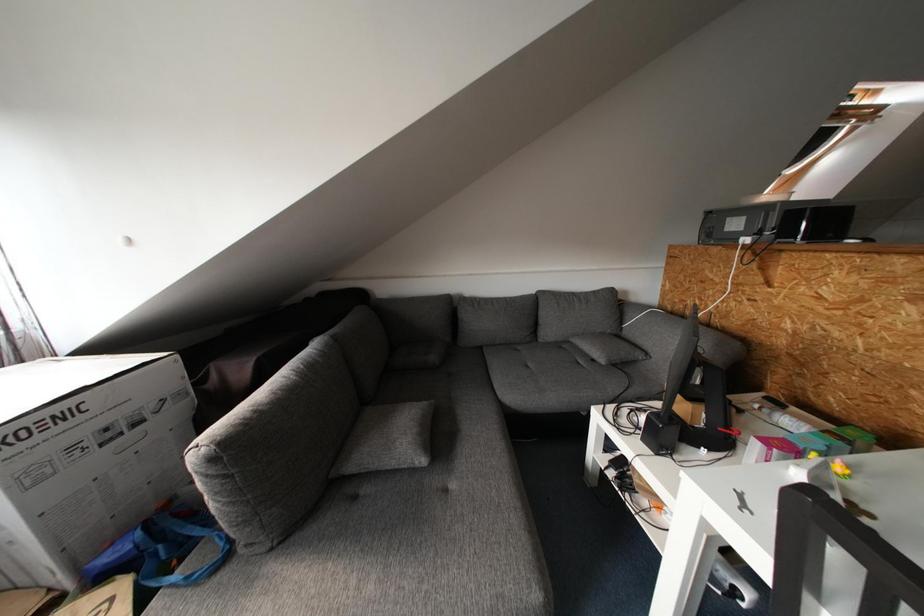
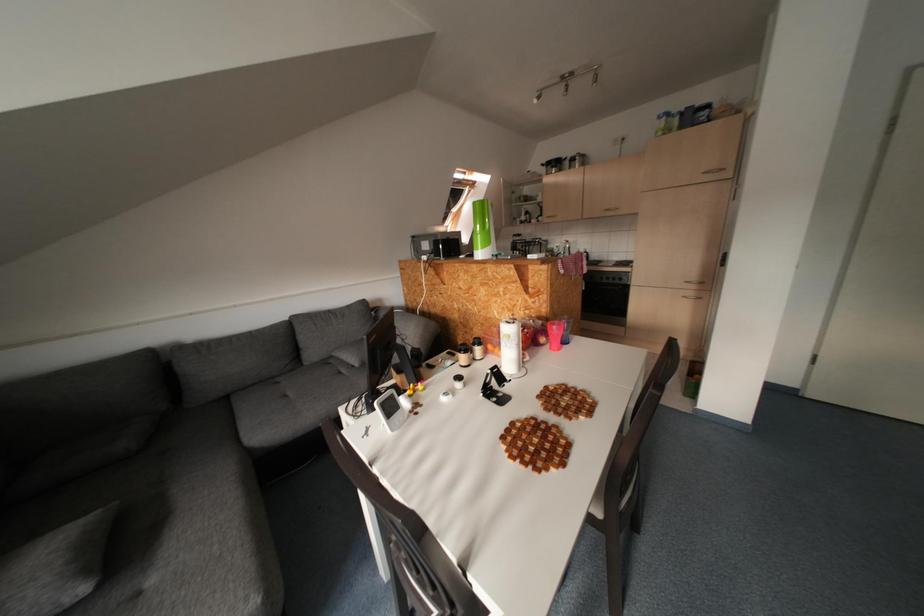
Question: How did the camera likely rotate?

Choices:
 (A) Left
 (B) Right
 (C) Up
 (D) Down

Answer: (B)